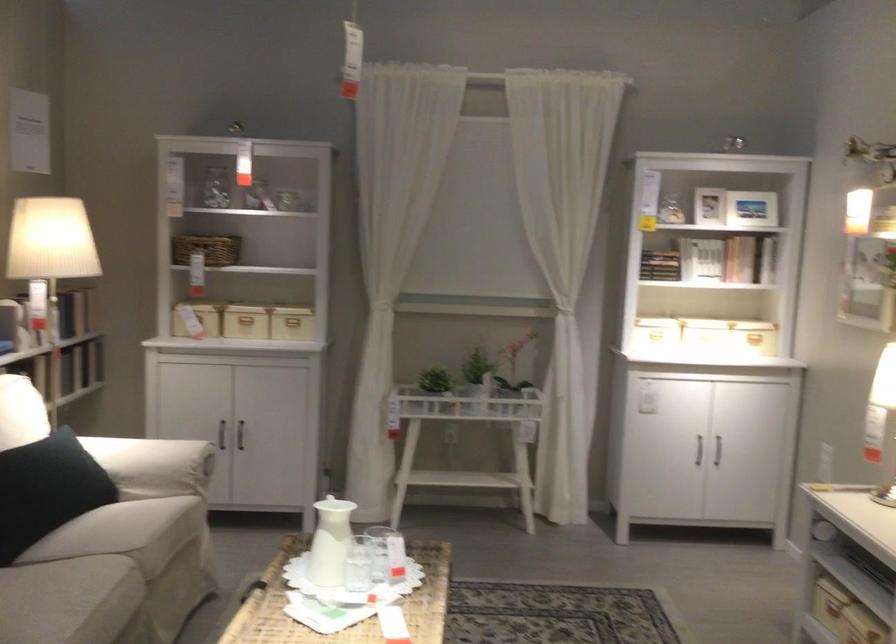
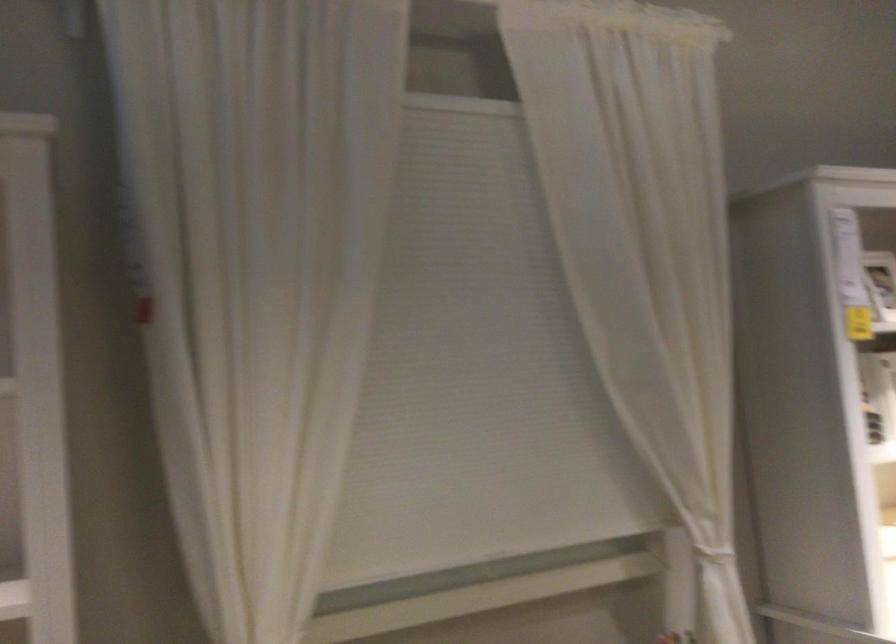
Question: Which direction would the cameraman need to move to produce the second image? Reply with the corresponding letter.

Choices:
 (A) Left
 (B) Right
 (C) Forward
 (D) Backward

Answer: (C)